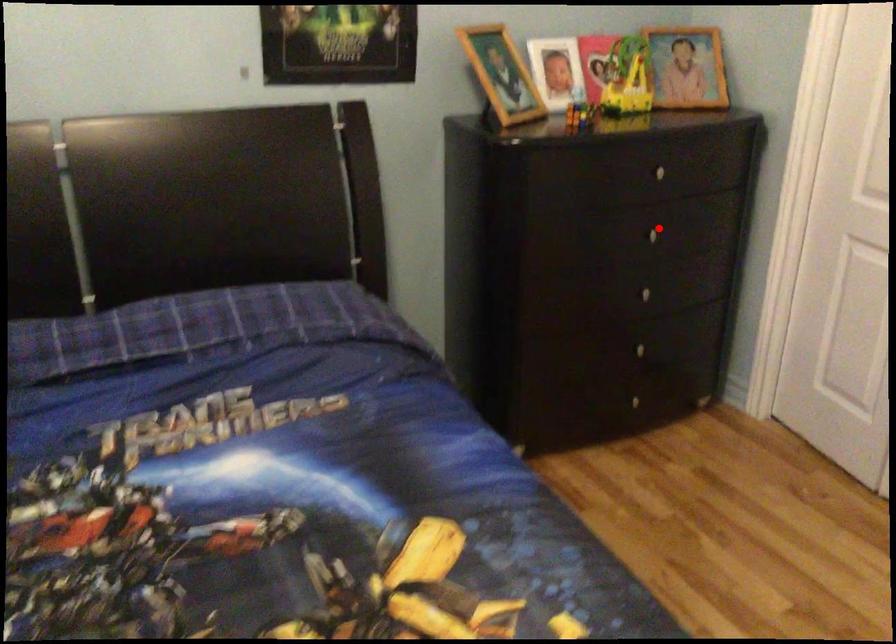
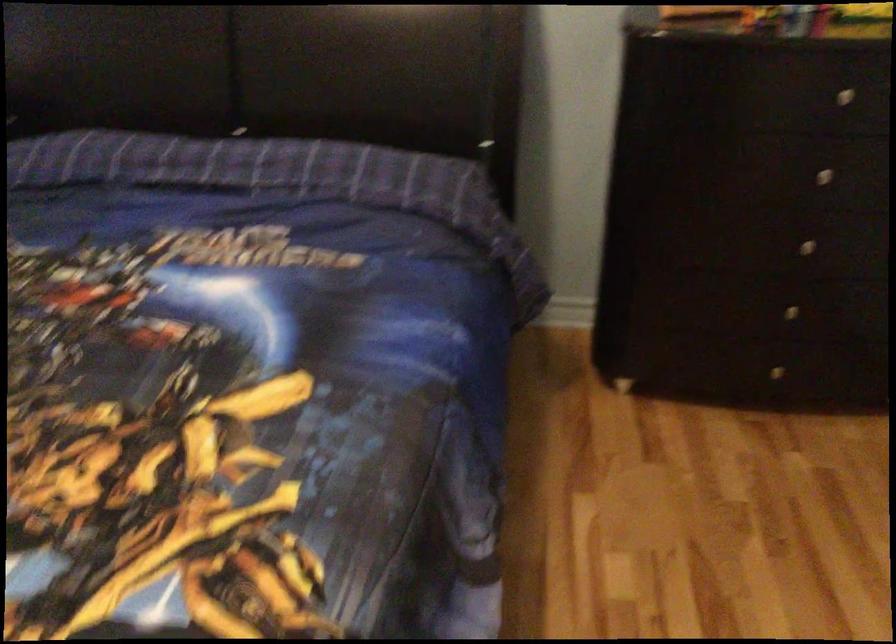
Question: I am providing you with two images of the same scene from different viewpoints. Given a red point in image1, look at the same physical point in image2. Is it:

Choices:
 (A) Closer to the viewpoint
 (B) Farther from the viewpoint

Answer: (A)